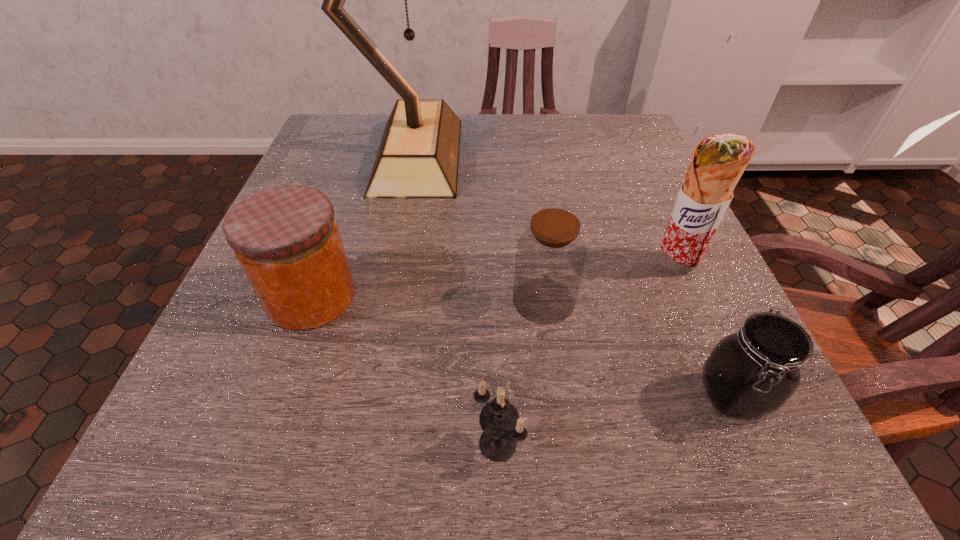
Find the location of a particular element. This screenshot has height=540, width=960. free space located on the back of the leftmost jar is located at coordinates [x=343, y=207].

At what (x,y) coordinates should I click in order to perform the action: click on vacant space located on the left of the second jar from right to left. Please return your answer as a coordinate pair (x, y). Image resolution: width=960 pixels, height=540 pixels. Looking at the image, I should click on (352, 300).

The width and height of the screenshot is (960, 540). I want to click on vacant space situated on the lid of the shortest jar, so click(x=765, y=470).

Find the location of a particular element. The image size is (960, 540). vacant space located on the back of the candle holder is located at coordinates (496, 379).

Where is `object situated at the far edge`? This screenshot has width=960, height=540. object situated at the far edge is located at coordinates (418, 157).

Locate an element on the screen. This screenshot has height=540, width=960. jar located in the near edge section of the desktop is located at coordinates (751, 373).

Identify the location of candle holder present at the near edge. (502, 427).

The height and width of the screenshot is (540, 960). What are the coordinates of `table lamp located at the left edge` in the screenshot? It's located at (418, 157).

Locate an element on the screen. jar positioned at the left edge is located at coordinates (286, 239).

In order to click on burrito that is at the right edge in this screenshot , I will do `click(718, 162)`.